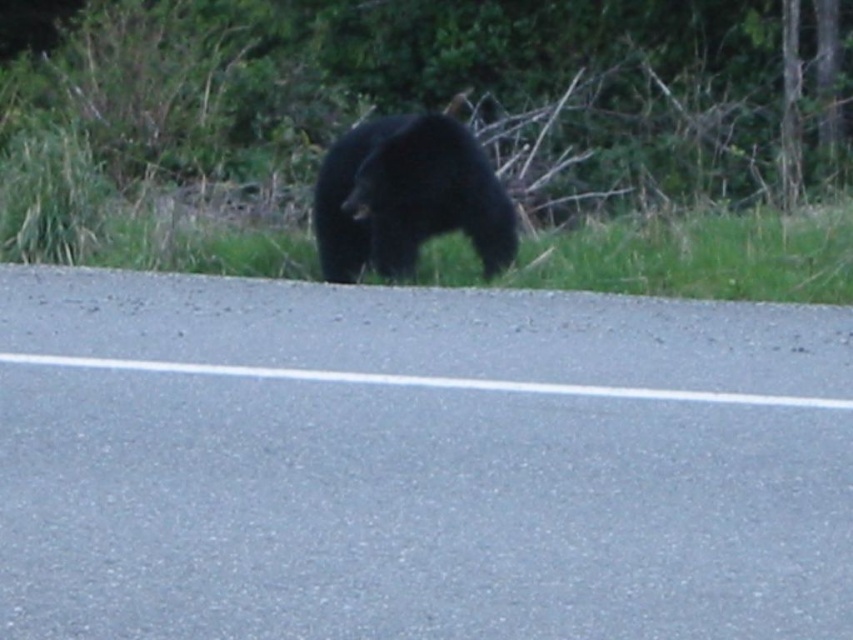
You are a driver approaching the asphalt road at center and see the black fur bear at center on the side of the road. Which object appears larger in the image?

The black fur bear at center appears larger than the asphalt road at center in the image.

You are a wildlife photographer trying to capture a photo of the black fur bear at center. You need to position yourself on the asphalt road at center to get the best shot. Considering the road and the bear are both at the center, which one is wider?

The asphalt road at center might be wider than black fur bear at center, so the road is wider.

You are a hiker who wants to cross the road safely. The asphalt road at center is in front of you, and the black fur bear at center is walking along the edge. Since the bear is taller than the road, can you see the bear clearly while crossing the road?

The asphalt road at center has a lesser height compared to black fur bear at center, so yes, you can see the bear clearly while crossing the road because the bear is taller than the road.